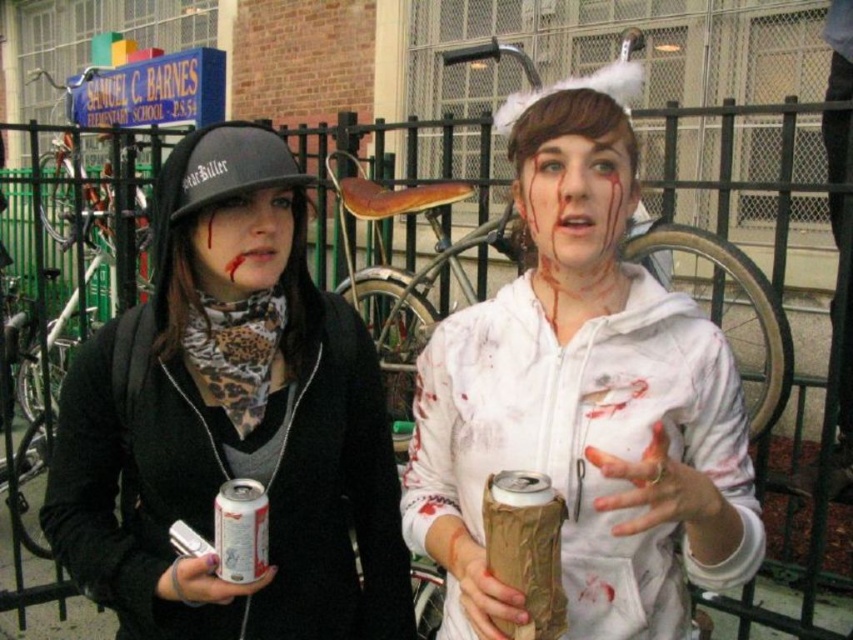
Image resolution: width=853 pixels, height=640 pixels. Identify the location of matte black cap at upper left. (231, 420).

Is matte black cap at upper left positioned at the back of silver metallic can at center?

Yes, it is behind silver metallic can at center.

Is point (358, 394) positioned before point (258, 564)?

No, (358, 394) is behind (258, 564).

Image resolution: width=853 pixels, height=640 pixels. What are the coordinates of `matte black cap at upper left` in the screenshot? It's located at (231, 420).

Is matte black cap at upper left closer to camera compared to matte black helmet at center?

Yes, it is in front of matte black helmet at center.

Can you confirm if matte black cap at upper left is bigger than matte black helmet at center?

Indeed, matte black cap at upper left has a larger size compared to matte black helmet at center.

Which is in front, point (363, 582) or point (235, 216)?

Point (235, 216) is in front.

Locate an element on the screen. The height and width of the screenshot is (640, 853). matte black cap at upper left is located at coordinates (231, 420).

Is matte black helmet at center wider than silver metallic can at center?

Yes, matte black helmet at center is wider than silver metallic can at center.

Is point (206, 209) farther from viewer compared to point (236, 532)?

That is True.

You are a GUI agent. You are given a task and a screenshot of the screen. Output one action in this format:
    pyautogui.click(x=<x>, y=<y>)
    Task: Click on the matte black helmet at center
    Image resolution: width=853 pixels, height=640 pixels.
    Given the screenshot: What is the action you would take?
    pyautogui.click(x=242, y=243)